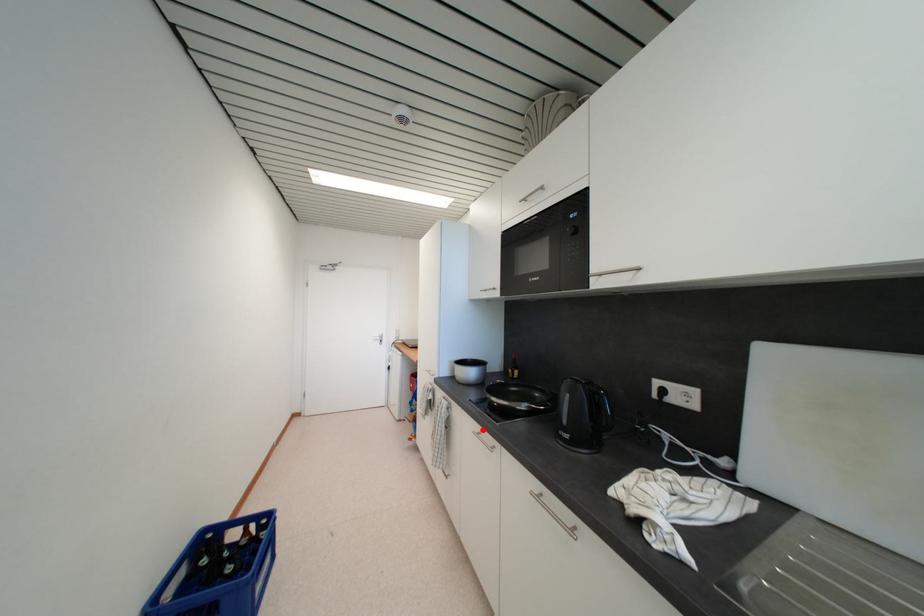
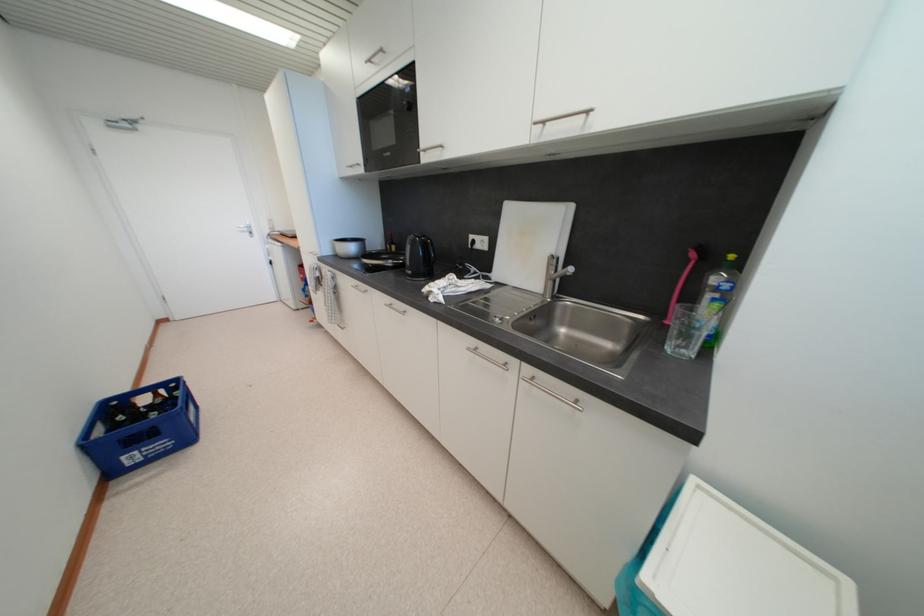
Question: I am providing you with two images of the same scene from different viewpoints. Given a red point in image1, look at the same physical point in image2. Is it:

Choices:
 (A) Closer to the viewpoint
 (B) Farther from the viewpoint

Answer: (B)